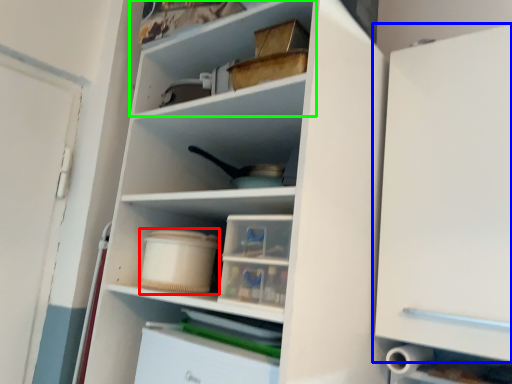
Question: Which is nearer to the storage box (highlighted by a red box)? cabinetry (highlighted by a blue box) or shelf (highlighted by a green box).

Choices:
 (A) cabinetry
 (B) shelf

Answer: (B)